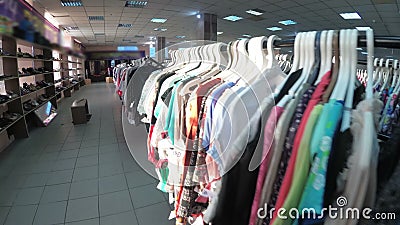
Locate an element on the screen. The image size is (400, 225). ceiling lights is located at coordinates (161, 22), (234, 19), (288, 22), (350, 20).